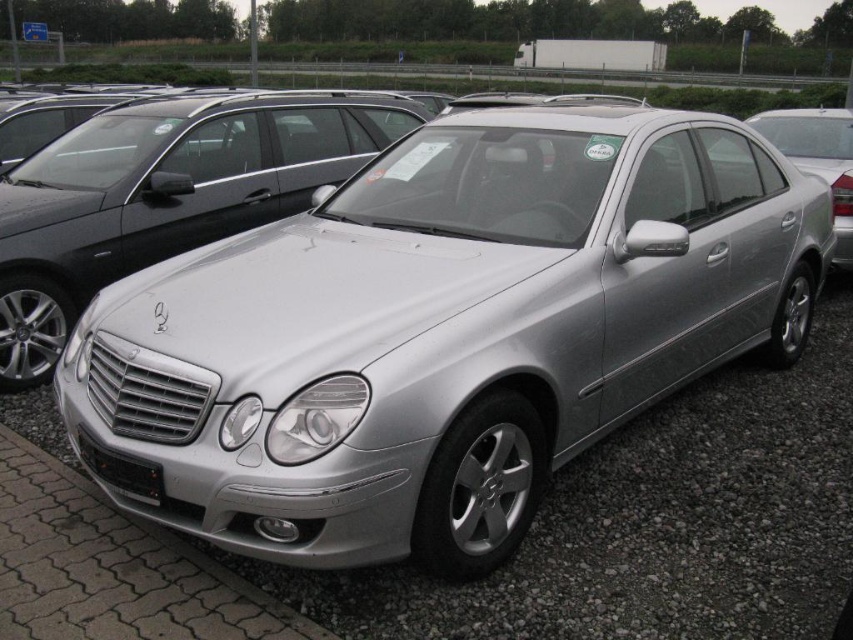
Does silver metallic car at center have a lesser height compared to satin silver car at center?

Correct, silver metallic car at center is not as tall as satin silver car at center.

Is point (312, 300) farther from viewer compared to point (198, 124)?

No, it is in front of (198, 124).

Between point (262, 483) and point (56, 216), which one is positioned in front?

Point (262, 483)

Find the location of a particular element. This screenshot has width=853, height=640. silver metallic car at center is located at coordinates (445, 330).

Image resolution: width=853 pixels, height=640 pixels. What do you see at coordinates (163, 195) in the screenshot?
I see `satin silver car at center` at bounding box center [163, 195].

Is satin silver car at center to the left of black matte license plate at front from the viewer's perspective?

Correct, you'll find satin silver car at center to the left of black matte license plate at front.

Which is behind, point (231, 212) or point (131, 470)?

The point (231, 212) is more distant.

Where is `satin silver car at center`? satin silver car at center is located at coordinates coord(163,195).

Who is more forward, (x=714, y=289) or (x=119, y=454)?

Point (x=119, y=454) is in front.

Looking at this image, is silver metallic car at center bigger than black matte license plate at front?

Yes, silver metallic car at center is bigger than black matte license plate at front.

Describe the element at coordinates (445, 330) in the screenshot. I see `silver metallic car at center` at that location.

Image resolution: width=853 pixels, height=640 pixels. Find the location of `silver metallic car at center`. silver metallic car at center is located at coordinates (445, 330).